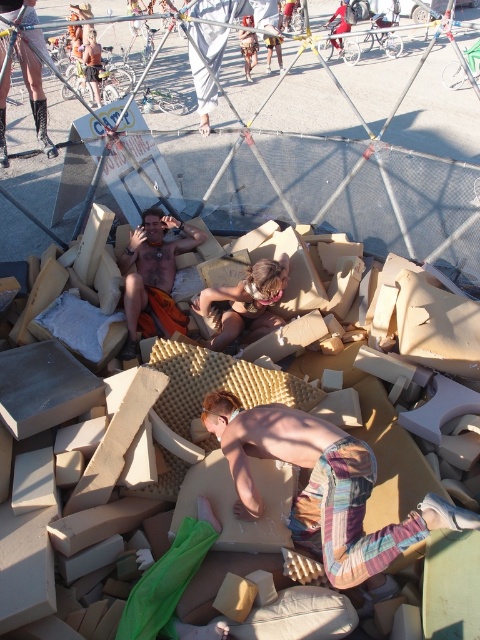
Question: Estimate the real-world distances between objects in this image. Which object is closer to the brown textured fabric at center?

Choices:
 (A) striped cotton shorts at center
 (B) shiny orange shorts at center

Answer: (B)

Question: Which of the following is the farthest from the observer?

Choices:
 (A) (382, 563)
 (B) (162, 221)
 (C) (244, 300)

Answer: (B)

Question: Does striped cotton shorts at center appear under shiny orange shorts at center?

Choices:
 (A) yes
 (B) no

Answer: (A)

Question: Is striped cotton shorts at center closer to camera compared to shiny orange shorts at center?

Choices:
 (A) yes
 (B) no

Answer: (A)

Question: Considering the relative positions of striped cotton shorts at center and brown textured fabric at center in the image provided, where is striped cotton shorts at center located with respect to brown textured fabric at center?

Choices:
 (A) above
 (B) below

Answer: (B)

Question: Among these points, which one is nearest to the camera?

Choices:
 (A) (216, 342)
 (B) (141, 324)
 (C) (358, 522)

Answer: (C)